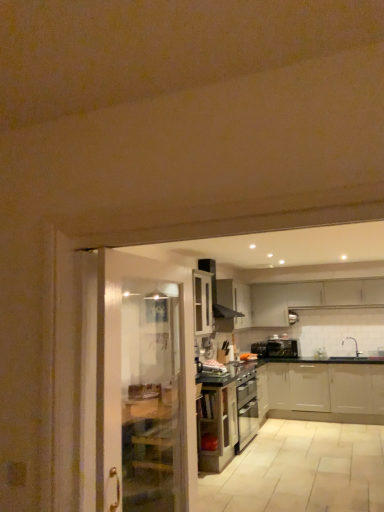
Find the location of a particular element. The image size is (384, 512). free location to the right of wooden cabinet at center is located at coordinates (262, 456).